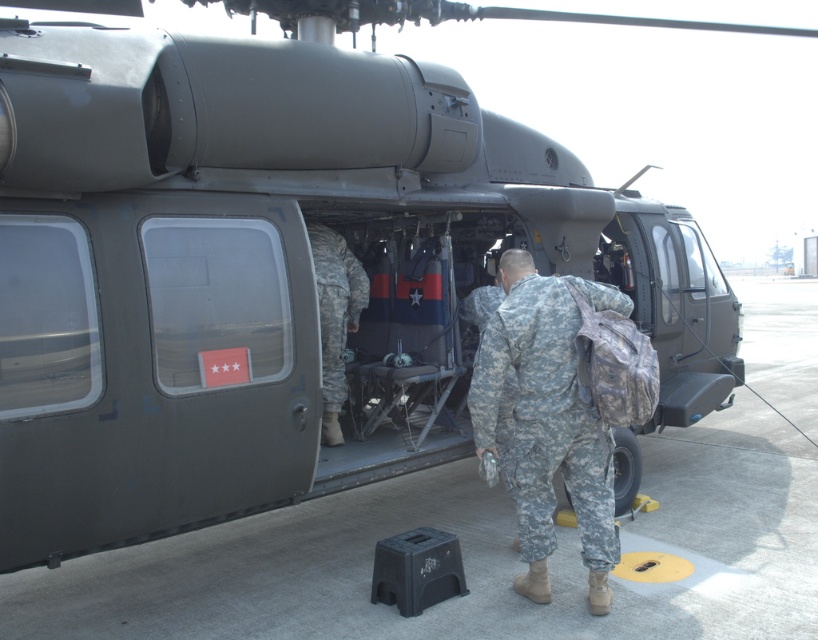
Between camouflage fabric soldier at center and camouflage uniform at center, which one has more height?

camouflage fabric soldier at center is taller.

Between camouflage fabric soldier at center and camouflage uniform at center, which one is positioned higher?

camouflage uniform at center is higher up.

Between point (600, 291) and point (330, 323), which one is positioned behind?

Point (330, 323)

The image size is (818, 640). Find the location of `camouflage fabric soldier at center`. camouflage fabric soldier at center is located at coordinates (546, 420).